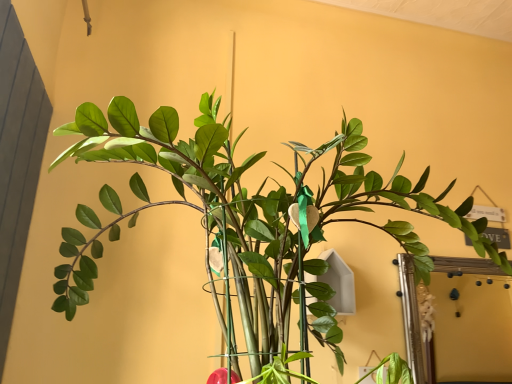
Question: Should I look upward or downward to see wooden-framed mirror at right?

Choices:
 (A) down
 (B) up

Answer: (A)